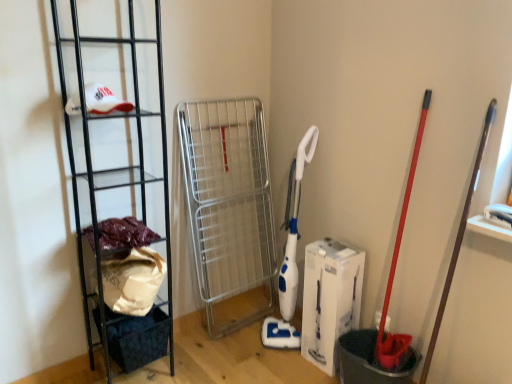
The width and height of the screenshot is (512, 384). I want to click on white cardboard box at center, so click(330, 299).

Image resolution: width=512 pixels, height=384 pixels. What do you see at coordinates (330, 299) in the screenshot?
I see `white cardboard box at center` at bounding box center [330, 299].

The width and height of the screenshot is (512, 384). What do you see at coordinates (118, 176) in the screenshot?
I see `black metal rack at left` at bounding box center [118, 176].

Where is `fuzzy fabric at left`? fuzzy fabric at left is located at coordinates (125, 234).

Considering the relative sizes of black metal rack at left and fuzzy fabric at left in the image provided, is black metal rack at left thinner than fuzzy fabric at left?

In fact, black metal rack at left might be wider than fuzzy fabric at left.

Is black metal rack at left placed right next to fuzzy fabric at left?

black metal rack at left and fuzzy fabric at left are not in contact.

In the image, there is a black metal rack at left. At what (x,y) coordinates should I click in order to perform the action: click on material below it (from the image's perspective). Please return your answer as a coordinate pair (x, y). Looking at the image, I should click on (125, 234).

In terms of height, does black metal rack at left look taller or shorter compared to fuzzy fabric at left?

In the image, black metal rack at left appears to be taller than fuzzy fabric at left.

Which of these two, white cardboard box at center or fuzzy fabric at left, is bigger?

With larger size is white cardboard box at center.

Could you tell me if white cardboard box at center is facing fuzzy fabric at left?

No.

Is fuzzy fabric at left surrounded by white cardboard box at center?

No.

The width and height of the screenshot is (512, 384). Identify the location of basket below the fuzzy fabric at left (from the image's perspective). (137, 338).

Can you tell me how much fuzzy fabric at left and dark blue fabric basket at lower left differ in facing direction?

fuzzy fabric at left and dark blue fabric basket at lower left are facing 2.14 degrees away from each other.

Considering the relative sizes of fuzzy fabric at left and dark blue fabric basket at lower left in the image provided, is fuzzy fabric at left thinner than dark blue fabric basket at lower left?

Correct, the width of fuzzy fabric at left is less than that of dark blue fabric basket at lower left.

Considering the sizes of objects fuzzy fabric at left and dark blue fabric basket at lower left in the image provided, who is bigger, fuzzy fabric at left or dark blue fabric basket at lower left?

dark blue fabric basket at lower left.

Considering the sizes of objects black metal rack at left and dark blue fabric basket at lower left in the image provided, who is shorter, black metal rack at left or dark blue fabric basket at lower left?

With less height is dark blue fabric basket at lower left.

Do you think black metal rack at left is within dark blue fabric basket at lower left, or outside of it?

black metal rack at left cannot be found inside dark blue fabric basket at lower left.

From the image's perspective, does black metal rack at left appear higher than dark blue fabric basket at lower left?

Yes, from the image's perspective, black metal rack at left is on top of dark blue fabric basket at lower left.

Which object is closer to the camera taking this photo, black metal rack at left or dark blue fabric basket at lower left?

black metal rack at left is closer to the camera.

From a real-world perspective, is white cardboard box at center physically above black metal rack at left?

No, from a real-world perspective, white cardboard box at center is not above black metal rack at left.

In the image, is white cardboard box at center on the left side or the right side of black metal rack at left?

Based on their positions, white cardboard box at center is located to the right of black metal rack at left.

Considering the sizes of objects white cardboard box at center and black metal rack at left in the image provided, who is wider, white cardboard box at center or black metal rack at left?

With larger width is black metal rack at left.

From the image's perspective, is white cardboard box at center positioned above or below black metal rack at left?

Clearly, from the image's perspective, white cardboard box at center is below black metal rack at left.

Is fuzzy fabric at left to the left of black metal rack at left from the viewer's perspective?

No, fuzzy fabric at left is not to the left of black metal rack at left.

Does point (123, 238) appear closer or farther from the camera than point (84, 272)?

Point (123, 238).

Is fuzzy fabric at left positioned far away from black metal rack at left?

fuzzy fabric at left is near black metal rack at left, not far away.

What's the angular difference between fuzzy fabric at left and black metal rack at left's facing directions?

fuzzy fabric at left and black metal rack at left are facing 0.596 degrees away from each other.

Does white cardboard box at center touch dark blue fabric basket at lower left?

No, white cardboard box at center is not in contact with dark blue fabric basket at lower left.

Does white cardboard box at center have a greater height compared to dark blue fabric basket at lower left?

Indeed, white cardboard box at center has a greater height compared to dark blue fabric basket at lower left.

From a real-world perspective, which object stands above the other?

white cardboard box at center, from a real-world perspective.

Considering the relative positions of white cardboard box at center and dark blue fabric basket at lower left in the image provided, is white cardboard box at center to the right of dark blue fabric basket at lower left from the viewer's perspective?

Yes.

Locate an element on the screen. The image size is (512, 384). ladder above the fuzzy fabric at left (from a real-world perspective) is located at coordinates (118, 176).

Locate an element on the screen. This screenshot has width=512, height=384. material on the left of white cardboard box at center is located at coordinates (125, 234).

Estimate the real-world distances between objects in this image. Which object is further from dark blue fabric basket at lower left, fuzzy fabric at left or white cardboard box at center?

Based on the image, white cardboard box at center appears to be further to dark blue fabric basket at lower left.

When comparing their distances from fuzzy fabric at left, does dark blue fabric basket at lower left or white cardboard box at center seem closer?

dark blue fabric basket at lower left lies closer to fuzzy fabric at left than the other object.

Based on their spatial positions, is black metal rack at left or dark blue fabric basket at lower left further from fuzzy fabric at left?

dark blue fabric basket at lower left.

Based on their spatial positions, is dark blue fabric basket at lower left or black metal rack at left further from white cardboard box at center?

black metal rack at left is further to white cardboard box at center.

When comparing their distances from dark blue fabric basket at lower left, does fuzzy fabric at left or black metal rack at left seem closer?

Based on the image, black metal rack at left appears to be nearer to dark blue fabric basket at lower left.

Looking at the image, which one is located closer to dark blue fabric basket at lower left, white cardboard box at center or black metal rack at left?

The object closer to dark blue fabric basket at lower left is black metal rack at left.

Looking at the image, which one is located further to white cardboard box at center, black metal rack at left or dark blue fabric basket at lower left?

black metal rack at left lies further to white cardboard box at center than the other object.

When comparing their distances from black metal rack at left, does dark blue fabric basket at lower left or white cardboard box at center seem further?

white cardboard box at center.

Locate an element on the screen. This screenshot has width=512, height=384. material between black metal rack at left and dark blue fabric basket at lower left in the up-down direction is located at coordinates (125, 234).

The width and height of the screenshot is (512, 384). I want to click on basket situated between black metal rack at left and white cardboard box at center from left to right, so click(x=137, y=338).

At what (x,y) coordinates should I click in order to perform the action: click on material between black metal rack at left and white cardboard box at center from left to right. Please return your answer as a coordinate pair (x, y). The width and height of the screenshot is (512, 384). Looking at the image, I should click on (125, 234).

In order to click on material between dark blue fabric basket at lower left and white cardboard box at center from left to right in this screenshot , I will do tap(125, 234).